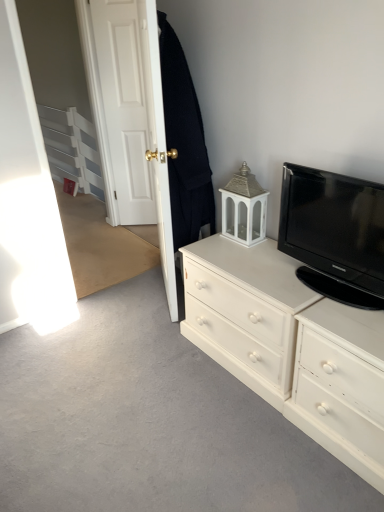
Locate an element on the screen. vacant position to the left of white wood door at upper left, which appears as the 2th door when viewed from the right is located at coordinates (112, 229).